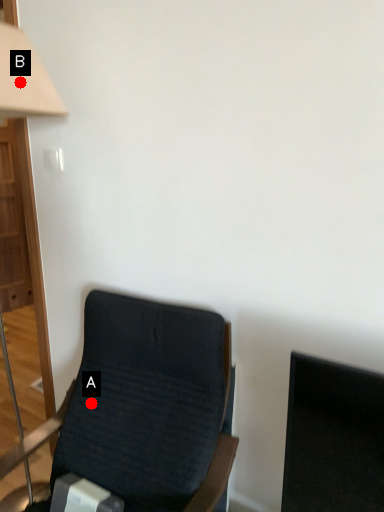
Question: Two points are circled on the image, labeled by A and B beside each circle. Which point appears farthest from the camera in this image?

Choices:
 (A) A is further
 (B) B is further

Answer: (A)